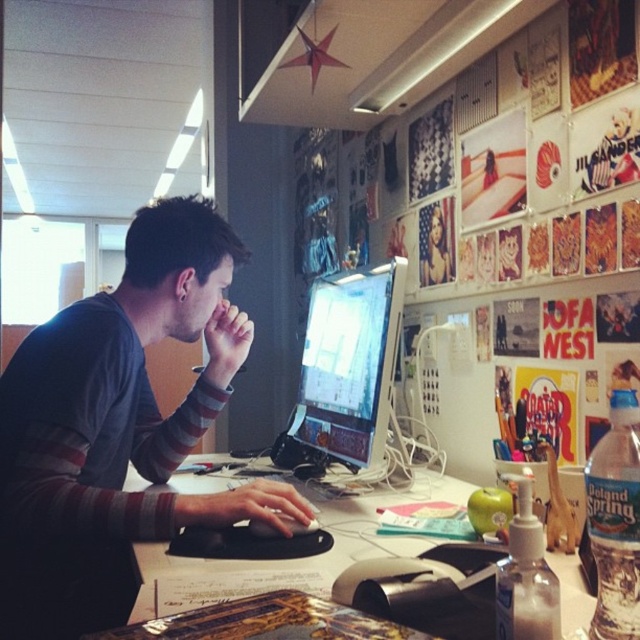
Question: Among these points, which one is farthest from the camera?

Choices:
 (A) (320, 362)
 (B) (323, 518)
 (C) (220, 324)

Answer: (A)

Question: Based on their relative distances, which object is nearer to the white plastic computer desk at center?

Choices:
 (A) gray striped shirt at center
 (B) satin black monitor at center

Answer: (A)

Question: In this image, where is gray striped shirt at center located relative to white plastic computer desk at center?

Choices:
 (A) above
 (B) below

Answer: (A)

Question: In this image, where is white plastic computer desk at center located relative to satin black monitor at center?

Choices:
 (A) below
 (B) above

Answer: (A)

Question: Does gray striped shirt at center have a smaller size compared to satin black monitor at center?

Choices:
 (A) yes
 (B) no

Answer: (B)

Question: Which point is farther to the camera?

Choices:
 (A) (152, 525)
 (B) (250, 577)
 (C) (321, 392)

Answer: (C)